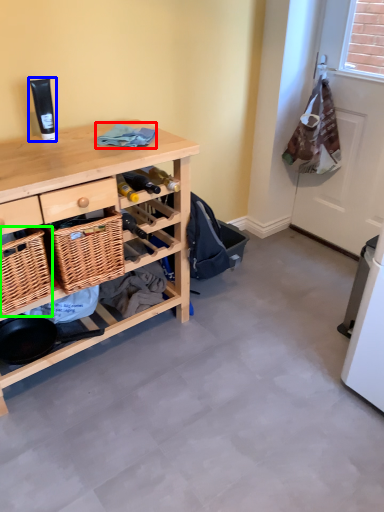
Question: Which object is positioned closest to clothing (highlighted by a red box)? Select from toiletry (highlighted by a blue box) and picnic basket (highlighted by a green box).

Choices:
 (A) toiletry
 (B) picnic basket

Answer: (A)